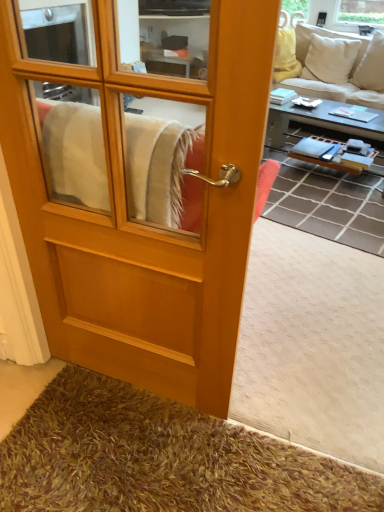
This screenshot has width=384, height=512. Identify the location of vacant space to the right of wooden door at center. (x=280, y=371).